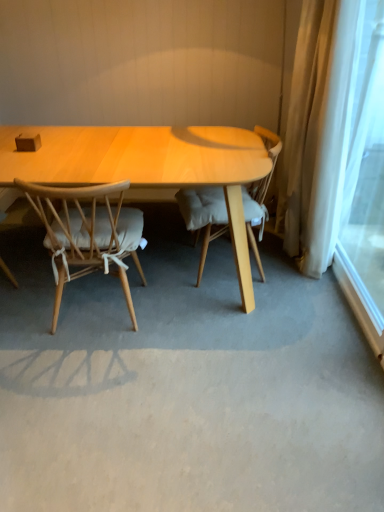
The width and height of the screenshot is (384, 512). Find the location of `vacant area in front of light brown wood chair at center, marked as the 1th chair in a right-to-left arrangement`. vacant area in front of light brown wood chair at center, marked as the 1th chair in a right-to-left arrangement is located at coordinates (230, 323).